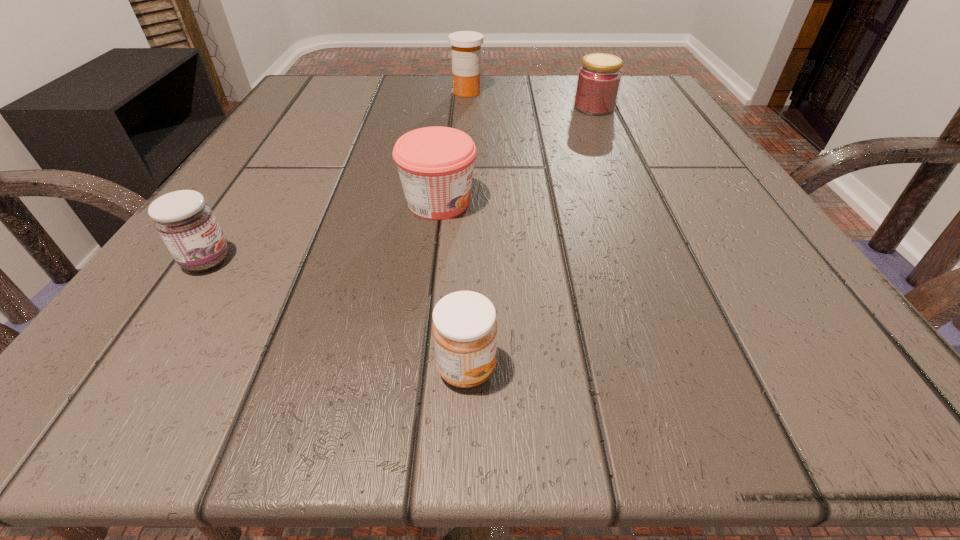
Find the location of a particular element. unoccupied area between the second nearest object and the fourth nearest object is located at coordinates (400, 184).

Find the location of a particular element. Image resolution: width=960 pixels, height=540 pixels. vacant point located between the third nearest object and the leftmost jam is located at coordinates (323, 231).

Where is `free point between the nearest object and the rightmost object`? free point between the nearest object and the rightmost object is located at coordinates (530, 238).

This screenshot has height=540, width=960. I want to click on object that ranks as the fourth closest to the third farthest object, so click(x=465, y=45).

Select which object appears as the second closest to the second farthest jam. Please provide its 2D coordinates. Your answer should be formatted as a tuple, i.e. [(x, y)], where the tuple contains the x and y coordinates of a point satisfying the conditions above.

[(464, 327)]

Identify which jam is the third closest to the nearest object. Please provide its 2D coordinates. Your answer should be formatted as a tuple, i.e. [(x, y)], where the tuple contains the x and y coordinates of a point satisfying the conditions above.

[(599, 78)]

This screenshot has height=540, width=960. Identify the location of the second closest jam relative to the nearest jam. pos(187,225).

At what (x,y) coordinates should I click in order to perform the action: click on free region that satisfies the following two spatial constraints: 1. on the label of the tallest object; 2. on the right side of the rightmost jam. Please return your answer as a coordinate pair (x, y). Looking at the image, I should click on (467, 107).

I want to click on vacant area in the image that satisfies the following two spatial constraints: 1. on the label of the tallest object; 2. on the front label of the leftmost object, so click(458, 260).